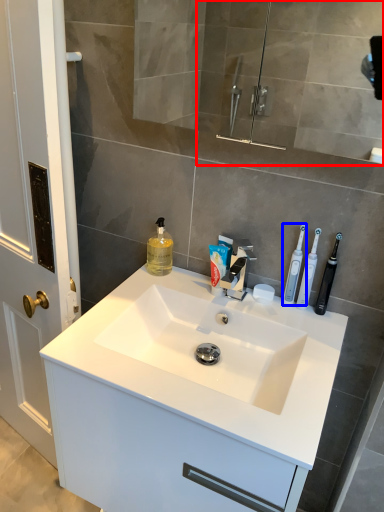
Question: Among these objects, which one is nearest to the camera, mirror (highlighted by a red box) or toothbrush (highlighted by a blue box)?

Choices:
 (A) mirror
 (B) toothbrush

Answer: (A)